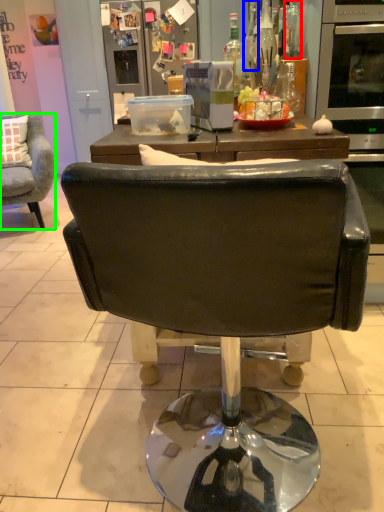
Question: Which object is positioned farthest from bottle (highlighted by a red box)? Select from bottle (highlighted by a blue box) and chair (highlighted by a green box).

Choices:
 (A) bottle
 (B) chair

Answer: (B)